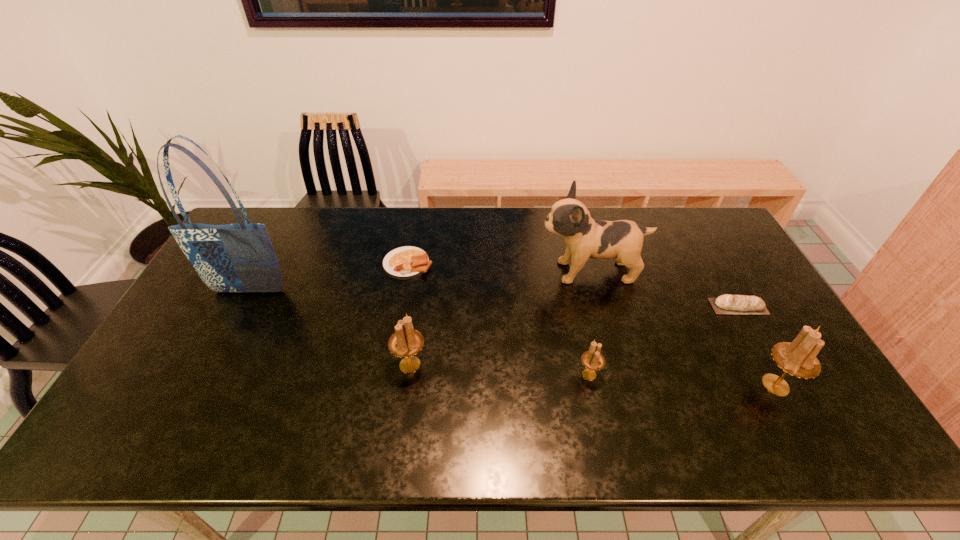
Identify the location of object at the far edge. This screenshot has width=960, height=540. (407, 262).

Locate an element on the screen. This screenshot has width=960, height=540. object located at the left edge is located at coordinates (240, 257).

At what (x,y) coordinates should I click in order to perform the action: click on candle holder present at the right edge. Please return your answer as a coordinate pair (x, y). Looking at the image, I should click on (798, 358).

In order to click on pita bread that is positioned at the right edge in this screenshot , I will do `click(725, 304)`.

Locate an element on the screen. object at the near right corner is located at coordinates (798, 358).

You are a GUI agent. You are given a task and a screenshot of the screen. Output one action in this format:
    pyautogui.click(x=<x>, y=<y>)
    Task: Click on the free space at the far edge
    
    Given the screenshot: What is the action you would take?
    pos(331,223)

In the image, there is a desktop. Where is `vacant space at the near edge`? vacant space at the near edge is located at coordinates (445, 388).

Where is `free region at the right edge of the desktop`? free region at the right edge of the desktop is located at coordinates (x=738, y=269).

Find the location of a particular element. vacant space at the far right corner of the desktop is located at coordinates 706,224.

Identify the location of free space between the puppy and the leftmost candle holder. (500, 318).